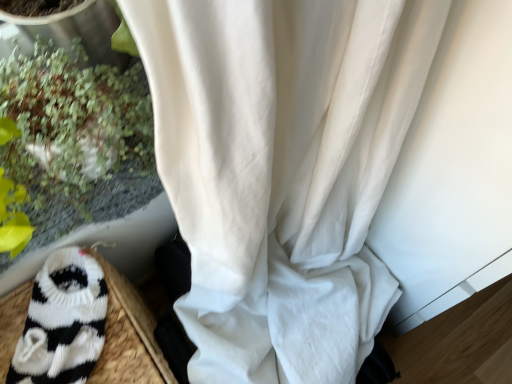
Question: Does white sheer curtain at center have a greater width compared to black knitted sock at lower left?

Choices:
 (A) yes
 (B) no

Answer: (A)

Question: Does white sheer curtain at center have a larger size compared to black knitted sock at lower left?

Choices:
 (A) no
 (B) yes

Answer: (B)

Question: Considering the relative sizes of white sheer curtain at center and black knitted sock at lower left in the image provided, is white sheer curtain at center smaller than black knitted sock at lower left?

Choices:
 (A) yes
 (B) no

Answer: (B)

Question: Is the surface of white sheer curtain at center in direct contact with black knitted sock at lower left?

Choices:
 (A) yes
 (B) no

Answer: (B)

Question: Considering the relative sizes of white sheer curtain at center and black knitted sock at lower left in the image provided, is white sheer curtain at center taller than black knitted sock at lower left?

Choices:
 (A) yes
 (B) no

Answer: (A)

Question: Does white sheer curtain at center lie behind black knitted sock at lower left?

Choices:
 (A) yes
 (B) no

Answer: (A)

Question: From the image's perspective, is black knitted sock at lower left under white sheer curtain at center?

Choices:
 (A) yes
 (B) no

Answer: (B)

Question: Considering the relative positions of black knitted sock at lower left and white sheer curtain at center in the image provided, is black knitted sock at lower left to the right of white sheer curtain at center from the viewer's perspective?

Choices:
 (A) yes
 (B) no

Answer: (B)

Question: Is black knitted sock at lower left in contact with white sheer curtain at center?

Choices:
 (A) yes
 (B) no

Answer: (B)

Question: Does black knitted sock at lower left have a lesser width compared to white sheer curtain at center?

Choices:
 (A) no
 (B) yes

Answer: (B)

Question: From a real-world perspective, does black knitted sock at lower left sit lower than white sheer curtain at center?

Choices:
 (A) no
 (B) yes

Answer: (A)

Question: Can you confirm if black knitted sock at lower left is positioned to the left of white sheer curtain at center?

Choices:
 (A) yes
 (B) no

Answer: (A)

Question: Does green leafy plant at left have a lesser height compared to white sheer curtain at center?

Choices:
 (A) no
 (B) yes

Answer: (B)